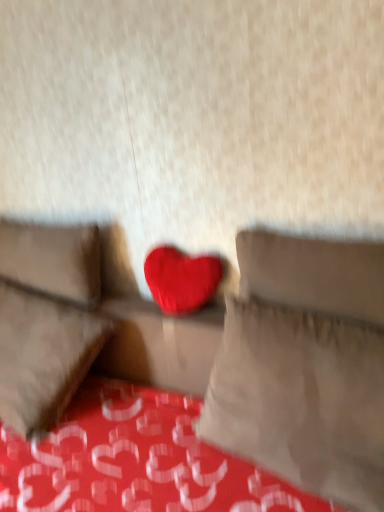
Question: Is matte fabric couch at center inside matte fabric heart at center, which appears as the 1th pillow when viewed from the right?

Choices:
 (A) yes
 (B) no

Answer: (B)

Question: Considering the relative sizes of matte fabric heart at center, which appears as the 1th pillow when viewed from the right, and matte fabric couch at center in the image provided, is matte fabric heart at center, which appears as the 1th pillow when viewed from the right, taller than matte fabric couch at center?

Choices:
 (A) no
 (B) yes

Answer: (B)

Question: Is matte fabric heart at center, which is the second pillow in back-to-front order, looking in the opposite direction of matte fabric couch at center?

Choices:
 (A) yes
 (B) no

Answer: (A)

Question: Can you confirm if matte fabric heart at center, which appears as the 1th pillow when viewed from the right, is smaller than matte fabric couch at center?

Choices:
 (A) yes
 (B) no

Answer: (A)

Question: Does matte fabric heart at center, which is the second pillow in back-to-front order, have a lesser width compared to matte fabric couch at center?

Choices:
 (A) no
 (B) yes

Answer: (B)

Question: Is matte fabric heart at center, which is the second pillow in back-to-front order, further to camera compared to matte fabric couch at center?

Choices:
 (A) no
 (B) yes

Answer: (B)

Question: Is matte fabric heart at center, which appears as the 1th pillow when viewed from the right, in front of suede-like beige pillow at left, which appears as the 1th pillow when viewed from the back?

Choices:
 (A) no
 (B) yes

Answer: (B)

Question: From the image's perspective, is matte fabric heart at center, which appears as the 1th pillow when viewed from the right, located above suede-like beige pillow at left, which appears as the 1th pillow when viewed from the back?

Choices:
 (A) no
 (B) yes

Answer: (A)

Question: Is matte fabric heart at center, which is the second pillow in back-to-front order, with suede-like beige pillow at left, placed as the 1th pillow when sorted from left to right?

Choices:
 (A) no
 (B) yes

Answer: (A)

Question: Considering the relative sizes of matte fabric heart at center, which is the second pillow in back-to-front order, and suede-like beige pillow at left, placed as the 1th pillow when sorted from left to right, in the image provided, is matte fabric heart at center, which is the second pillow in back-to-front order, thinner than suede-like beige pillow at left, placed as the 1th pillow when sorted from left to right,?

Choices:
 (A) no
 (B) yes

Answer: (A)

Question: Does matte fabric heart at center, which is the second pillow in back-to-front order, appear on the right side of suede-like beige pillow at left, which appears as the 2th pillow when viewed from the front?

Choices:
 (A) no
 (B) yes

Answer: (B)

Question: Considering the relative positions of matte fabric heart at center, placed as the second pillow when sorted from left to right, and suede-like beige pillow at left, which appears as the 1th pillow when viewed from the back, in the image provided, is matte fabric heart at center, placed as the second pillow when sorted from left to right, to the left of suede-like beige pillow at left, which appears as the 1th pillow when viewed from the back, from the viewer's perspective?

Choices:
 (A) yes
 (B) no

Answer: (B)

Question: Would you say matte fabric couch at center contains suede-like beige pillow at left, which appears as the 2th pillow when viewed from the front?

Choices:
 (A) no
 (B) yes

Answer: (A)